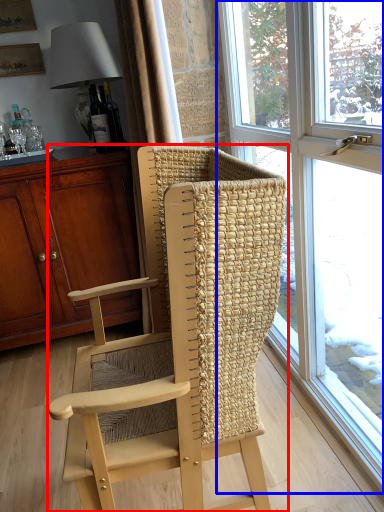
Question: Which of the following is the farthest to the observer, chair (highlighted by a red box) or window (highlighted by a blue box)?

Choices:
 (A) chair
 (B) window

Answer: (B)